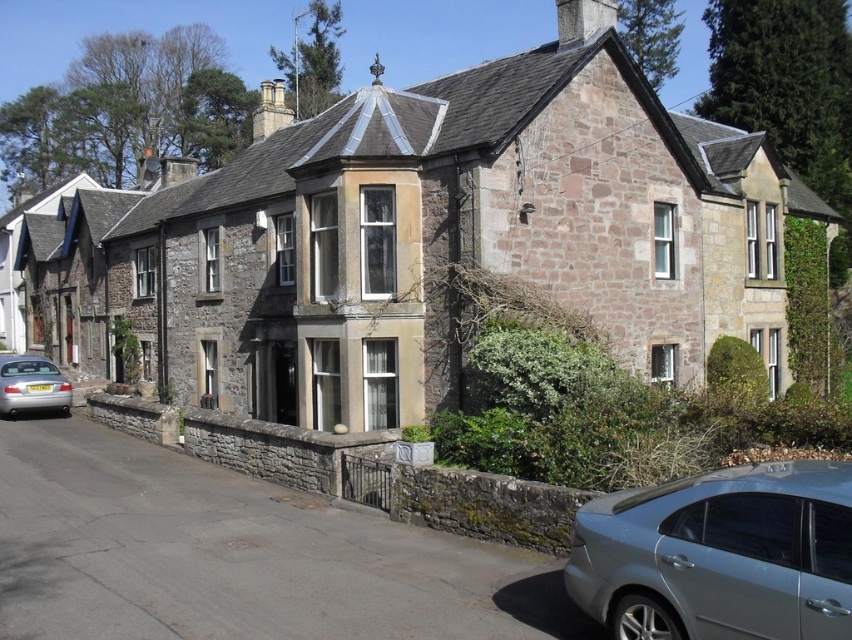
You are standing in front of the traditional stone house and notice two cars parked nearby. The satin silver sedan at lower right and the silver metallic car at lower left. Which car is closer to you?

The satin silver sedan at lower right is closer to the viewer than the silver metallic car at lower left.

You are a delivery driver who needs to park your truck, which is taller than both cars, between the satin silver sedan at lower right and the silver metallic car at lower left. Can you fit your truck in this space?

The satin silver sedan at lower right is not as tall as silver metallic car at lower left, but since your truck is taller than both cars, you cannot fit it between them as the space between them may not accommodate the truck height.